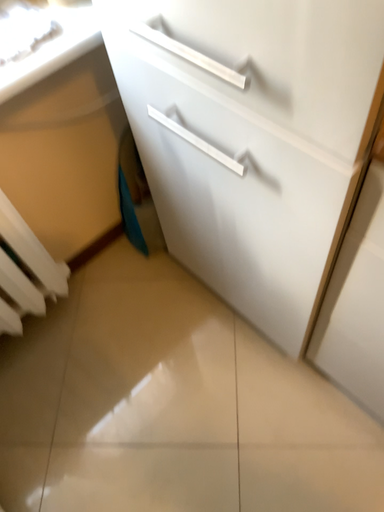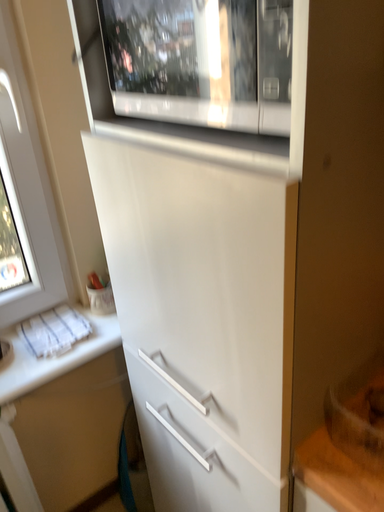
Question: How did the camera likely rotate when shooting the video?

Choices:
 (A) rotated upward
 (B) rotated downward

Answer: (A)